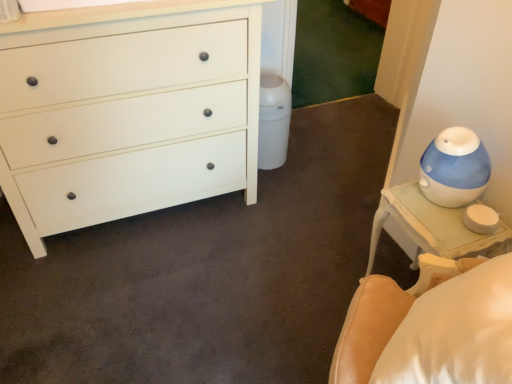
Question: Is white glossy nightstand at right in front of or behind white matte chest of drawers at left in the image?

Choices:
 (A) behind
 (B) front

Answer: (A)

Question: Considering the positions of point (449, 228) and point (10, 175), is point (449, 228) closer or farther from the camera than point (10, 175)?

Choices:
 (A) farther
 (B) closer

Answer: (B)

Question: From a real-world perspective, is white glossy nightstand at right positioned above or below white matte chest of drawers at left?

Choices:
 (A) below
 (B) above

Answer: (A)

Question: Is white matte chest of drawers at left taller or shorter than white glossy nightstand at right?

Choices:
 (A) tall
 (B) short

Answer: (A)

Question: Relative to white glossy nightstand at right, is white matte chest of drawers at left in front or behind?

Choices:
 (A) behind
 (B) front

Answer: (B)

Question: Considering the positions of point (188, 61) and point (421, 200), is point (188, 61) closer or farther from the camera than point (421, 200)?

Choices:
 (A) closer
 (B) farther

Answer: (B)

Question: Would you say white matte chest of drawers at left is inside or outside white glossy nightstand at right?

Choices:
 (A) inside
 (B) outside

Answer: (B)